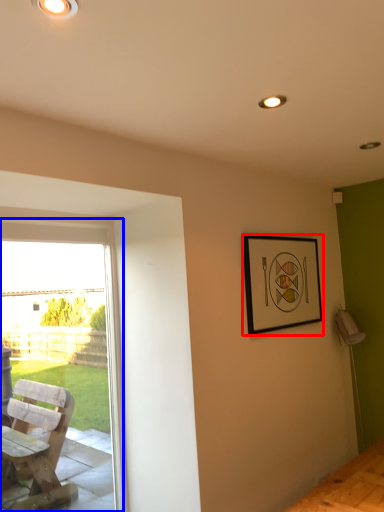
Question: Which object appears closest to the camera in this image, picture frame (highlighted by a red box) or window (highlighted by a blue box)?

Choices:
 (A) picture frame
 (B) window

Answer: (B)